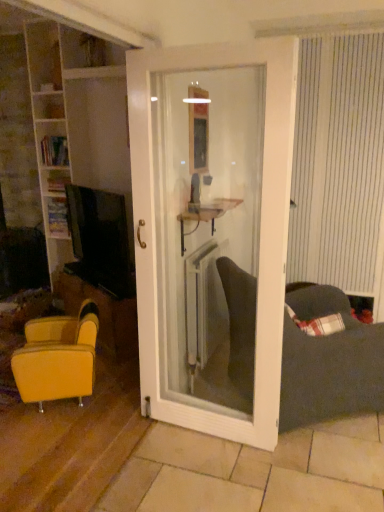
Question: Is yellow leather chair at left, which is the 1th table in bottom-to-top order, shorter than white metallic radiator at center?

Choices:
 (A) yes
 (B) no

Answer: (A)

Question: Does yellow leather chair at left, marked as the second table in a right-to-left arrangement, appear on the left side of white metallic radiator at center?

Choices:
 (A) no
 (B) yes

Answer: (B)

Question: From a real-world perspective, is yellow leather chair at left, which is the first table in left-to-right order, on top of white metallic radiator at center?

Choices:
 (A) yes
 (B) no

Answer: (B)

Question: Considering the relative positions of yellow leather chair at left, which is the first table in left-to-right order, and white metallic radiator at center in the image provided, is yellow leather chair at left, which is the first table in left-to-right order, to the right of white metallic radiator at center from the viewer's perspective?

Choices:
 (A) yes
 (B) no

Answer: (B)

Question: From a real-world perspective, is white wooden door at center above or below white wood bookshelf at left?

Choices:
 (A) above
 (B) below

Answer: (B)

Question: Considering the relative positions of white wooden door at center and white wood bookshelf at left in the image provided, is white wooden door at center to the left or to the right of white wood bookshelf at left?

Choices:
 (A) right
 (B) left

Answer: (A)

Question: Is white wooden door at center in front of or behind white wood bookshelf at left in the image?

Choices:
 (A) front
 (B) behind

Answer: (A)

Question: Looking at their shapes, would you say white wooden door at center is wider or thinner than white wood bookshelf at left?

Choices:
 (A) wide
 (B) thin

Answer: (B)

Question: From a real-world perspective, is leather-like yellow armchair at lower left positioned above or below white metallic radiator at center?

Choices:
 (A) above
 (B) below

Answer: (B)

Question: Relative to white metallic radiator at center, is leather-like yellow armchair at lower left in front or behind?

Choices:
 (A) behind
 (B) front

Answer: (B)

Question: From the image's perspective, relative to white metallic radiator at center, is leather-like yellow armchair at lower left above or below?

Choices:
 (A) above
 (B) below

Answer: (B)

Question: Visually, is leather-like yellow armchair at lower left positioned to the left or to the right of white metallic radiator at center?

Choices:
 (A) left
 (B) right

Answer: (A)

Question: Is white wooden door at center in front of or behind yellow leather chair at left, marked as the second table in a right-to-left arrangement, in the image?

Choices:
 (A) behind
 (B) front

Answer: (B)

Question: Is point (163, 68) positioned closer to the camera than point (74, 308)?

Choices:
 (A) closer
 (B) farther

Answer: (A)